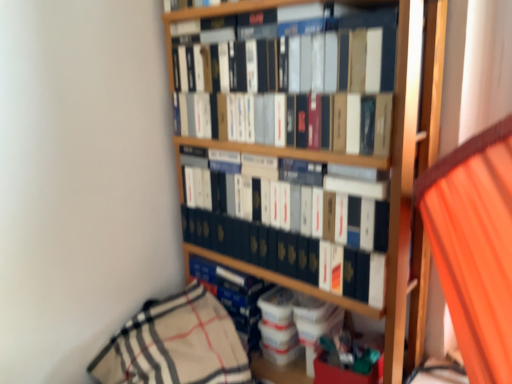
Question: Considering the relative positions of blue hardcover book at center, which appears as the 1th book when ordered from the bottom, and matte black book at upper center, which appears as the 1th book when viewed from the top, in the image provided, is blue hardcover book at center, which appears as the 1th book when ordered from the bottom, to the left or to the right of matte black book at upper center, which appears as the 1th book when viewed from the top,?

Choices:
 (A) right
 (B) left

Answer: (B)

Question: Considering the positions of blue hardcover book at center, the 3th book from the top, and matte black book at upper center, the 3th book in the bottom-to-top sequence, in the image, is blue hardcover book at center, the 3th book from the top, wider or thinner than matte black book at upper center, the 3th book in the bottom-to-top sequence,?

Choices:
 (A) thin
 (B) wide

Answer: (B)

Question: Estimate the real-world distances between objects in this image. Which object is closer to the matte black book at center, the 2th book from the bottom?

Choices:
 (A) matte black book at upper center, the 3th book in the bottom-to-top sequence
 (B) blue hardcover book at center, which appears as the 1th book when ordered from the bottom
 (C) orange fabric curtain at right

Answer: (B)

Question: Which object is the farthest from the matte black book at upper center, the 3th book in the bottom-to-top sequence?

Choices:
 (A) matte black book at center, the 2th book from the bottom
 (B) blue hardcover book at center, which appears as the 1th book when ordered from the bottom
 (C) orange fabric curtain at right

Answer: (C)